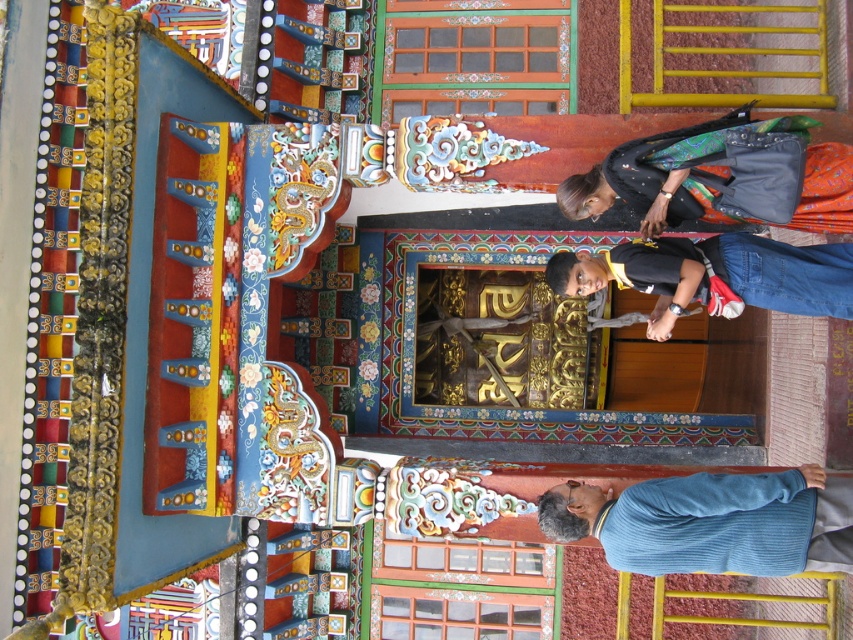
You are standing in front of the temple structure and notice a blue corduroy sweater at lower right. Where exactly is the blue corduroy sweater located in terms of coordinates?

The blue corduroy sweater at lower right is located at coordinates point (705, 522).